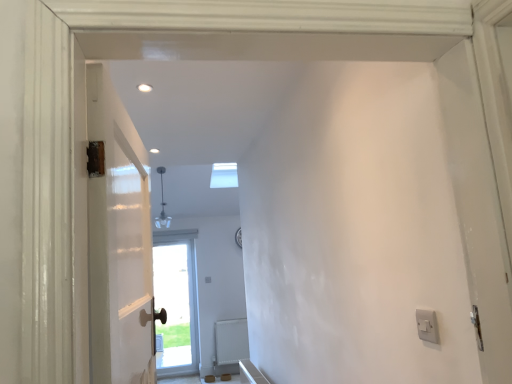
Identify the location of white painted wood door at left, which is the 1th door from top to bottom. (118, 243).

Find the location of `matte brown door at center, which is the second door in front-to-back order`. matte brown door at center, which is the second door in front-to-back order is located at coordinates (176, 306).

Would you say white plastic switch at right is outside white painted wood door at left, the second door positioned from the bottom?

Absolutely, white plastic switch at right is external to white painted wood door at left, the second door positioned from the bottom.

Is white plastic switch at right taller or shorter than white painted wood door at left, the second door positioned from the back?

Clearly, white plastic switch at right is shorter compared to white painted wood door at left, the second door positioned from the back.

From a real-world perspective, relative to white painted wood door at left, the second door positioned from the back, is white plastic switch at right vertically above or below?

From a real-world perspective, white plastic switch at right is physically below white painted wood door at left, the second door positioned from the back.

Can you confirm if white painted wood door at left, which appears as the 1th door when viewed from the front, is smaller than white plastic switch at right?

No.

Is white painted wood door at left, marked as the 1th door in a right-to-left arrangement, to the left of white plastic switch at right from the viewer's perspective?

Yes, white painted wood door at left, marked as the 1th door in a right-to-left arrangement, is to the left of white plastic switch at right.

Considering the sizes of white painted wood door at left, which appears as the 1th door when viewed from the front, and white plastic switch at right in the image, is white painted wood door at left, which appears as the 1th door when viewed from the front, wider or thinner than white plastic switch at right?

Clearly, white painted wood door at left, which appears as the 1th door when viewed from the front, has more width compared to white plastic switch at right.

Can we say white painted wood door at left, marked as the 1th door in a right-to-left arrangement, lies outside white plastic switch at right?

Absolutely, white painted wood door at left, marked as the 1th door in a right-to-left arrangement, is external to white plastic switch at right.

Does white painted wood door at left, which is the 1th door from top to bottom, lie in front of white matte radiator at lower center?

Yes, it is.

Which of these two, white painted wood door at left, which appears as the 1th door when viewed from the front, or white matte radiator at lower center, is thinner?

Thinner between the two is white matte radiator at lower center.

How far apart are white painted wood door at left, the second door positioned from the bottom, and white matte radiator at lower center?

white painted wood door at left, the second door positioned from the bottom, and white matte radiator at lower center are 4.93 meters apart.

Which is more to the right, white painted wood door at left, which appears as the 1th door when viewed from the front, or white matte radiator at lower center?

From the viewer's perspective, white painted wood door at left, which appears as the 1th door when viewed from the front, appears more on the right side.

In the image, is matte brown door at center, which is the second door in front-to-back order, on the left side or the right side of white matte radiator at lower center?

matte brown door at center, which is the second door in front-to-back order, is positioned on white matte radiator at lower center's left side.

Is there a large distance between matte brown door at center, which is the 1th door in bottom-to-top order, and white matte radiator at lower center?

No, there isn't a large distance between matte brown door at center, which is the 1th door in bottom-to-top order, and white matte radiator at lower center.

Who is taller, matte brown door at center, which is the second door in front-to-back order, or white matte radiator at lower center?

Standing taller between the two is matte brown door at center, which is the second door in front-to-back order.

Do you think matte brown door at center, which is the second door in front-to-back order, is within white matte radiator at lower center, or outside of it?

matte brown door at center, which is the second door in front-to-back order, is spatially situated outside white matte radiator at lower center.

From a real-world perspective, relative to white matte radiator at lower center, is white plastic switch at right vertically above or below?

white plastic switch at right is situated higher than white matte radiator at lower center in the real world.

Is white plastic switch at right surrounding white matte radiator at lower center?

A: No, white matte radiator at lower center is not a part of white plastic switch at right.

Is point (432, 329) farther from viewer compared to point (229, 354)?

No.

From the image's perspective, which one is positioned higher, white plastic switch at right or white matte radiator at lower center?

white plastic switch at right.

Is matte brown door at center, which is the 1th door in bottom-to-top order, positioned far away from white plastic switch at right?

Yes.

Can you confirm if matte brown door at center, the 2th door viewed from the top, is positioned to the right of white plastic switch at right?

No.

From a real-world perspective, between matte brown door at center, which is the second door in front-to-back order, and white plastic switch at right, who is vertically lower?

In real-world perspective, matte brown door at center, which is the second door in front-to-back order, is lower.

How different are the orientations of matte brown door at center, the 2th door viewed from the top, and white plastic switch at right in degrees?

90.3 degrees.

Find the location of a particular element. The width and height of the screenshot is (512, 384). door below the white painted wood door at left, which is the 1th door from top to bottom (from a real-world perspective) is located at coordinates (176, 306).

From the image's perspective, is matte brown door at center, arranged as the first door when viewed from the left, located above white painted wood door at left, the second door positioned from the back?

No, from the image's perspective, matte brown door at center, arranged as the first door when viewed from the left, is not over white painted wood door at left, the second door positioned from the back.

Would you say white painted wood door at left, marked as the 1th door in a right-to-left arrangement, is part of matte brown door at center, which is the second door in front-to-back order,'s contents?

No, white painted wood door at left, marked as the 1th door in a right-to-left arrangement, is located outside of matte brown door at center, which is the second door in front-to-back order.

In the image, there is a white plastic switch at right. Identify the location of door above it (from the image's perspective). (118, 243).

This screenshot has height=384, width=512. What are the coordinates of `door above the white plastic switch at right (from a real-world perspective)` in the screenshot? It's located at (118, 243).

Estimate the real-world distances between objects in this image. Which object is further from white matte radiator at lower center, matte brown door at center, the 2th door viewed from the top, or white painted wood door at left, marked as the 1th door in a right-to-left arrangement?

white painted wood door at left, marked as the 1th door in a right-to-left arrangement, is positioned further to the anchor white matte radiator at lower center.

From the image, which object appears to be nearer to white plastic switch at right, matte brown door at center, the 2th door viewed from the top, or white matte radiator at lower center?

Based on the image, white matte radiator at lower center appears to be nearer to white plastic switch at right.

Estimate the real-world distances between objects in this image. Which object is closer to white matte radiator at lower center, white painted wood door at left, which appears as the 1th door when viewed from the front, or matte brown door at center, arranged as the first door when viewed from the left?

matte brown door at center, arranged as the first door when viewed from the left, lies closer to white matte radiator at lower center than the other object.

Estimate the real-world distances between objects in this image. Which object is closer to white painted wood door at left, the second door from the left, white plastic switch at right or white matte radiator at lower center?

white plastic switch at right.

From the image, which object appears to be farther from white plastic switch at right, white painted wood door at left, which is the 1th door from top to bottom, or white matte radiator at lower center?

white matte radiator at lower center is further to white plastic switch at right.

Estimate the real-world distances between objects in this image. Which object is closer to matte brown door at center, which is the second door in front-to-back order, white plastic switch at right or white matte radiator at lower center?

white matte radiator at lower center is positioned closer to the anchor matte brown door at center, which is the second door in front-to-back order.

When comparing their distances from white painted wood door at left, the second door from the left, does white matte radiator at lower center or matte brown door at center, which is the 1th door in bottom-to-top order, seem closer?

Based on the image, white matte radiator at lower center appears to be nearer to white painted wood door at left, the second door from the left.

Estimate the real-world distances between objects in this image. Which object is further from matte brown door at center, placed as the 1th door when sorted from back to front, white matte radiator at lower center or white plastic switch at right?

Among the two, white plastic switch at right is located further to matte brown door at center, placed as the 1th door when sorted from back to front.

Locate an element on the screen. The image size is (512, 384). radiator between white painted wood door at left, which is the 1th door from top to bottom, and matte brown door at center, which is the second door in front-to-back order, from front to back is located at coordinates (231, 341).

Identify the location of electric outlet between white painted wood door at left, which appears as the 1th door when viewed from the front, and matte brown door at center, arranged as the first door when viewed from the left, from front to back. (426, 325).

Where is `electric outlet between white painted wood door at left, marked as the 1th door in a right-to-left arrangement, and white matte radiator at lower center in the front-back direction`? This screenshot has height=384, width=512. electric outlet between white painted wood door at left, marked as the 1th door in a right-to-left arrangement, and white matte radiator at lower center in the front-back direction is located at coordinates (426, 325).

I want to click on radiator between white plastic switch at right and matte brown door at center, which is the 1th door in bottom-to-top order, along the z-axis, so click(231, 341).